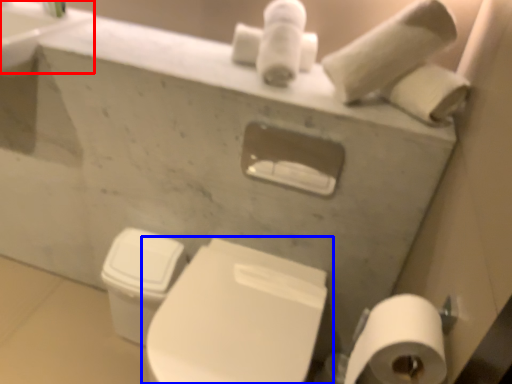
Question: Among these objects, which one is nearest to the camera, sink (highlighted by a red box) or toilet (highlighted by a blue box)?

Choices:
 (A) sink
 (B) toilet

Answer: (B)